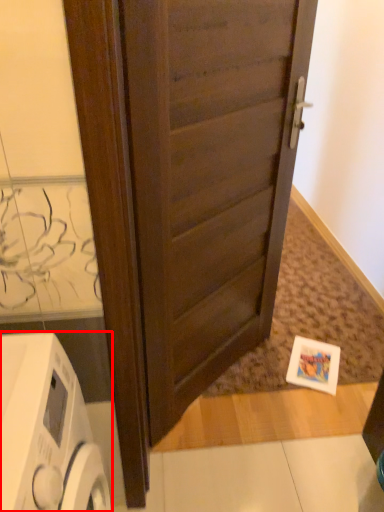
Question: From the image's perspective, what is the correct spatial positioning of home appliance (annotated by the red box) in reference to door?

Choices:
 (A) above
 (B) below

Answer: (B)